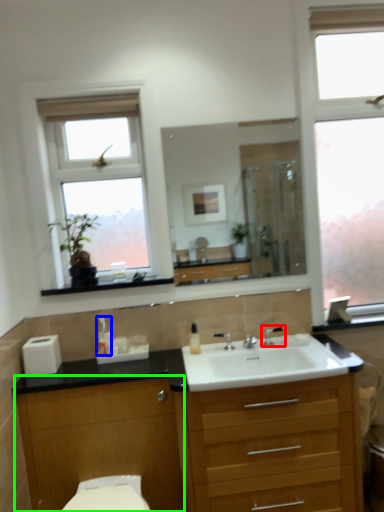
Question: Which is farther away from tap (highlighted by a red box)? soap dispenser (highlighted by a blue box) or cabinetry (highlighted by a green box)?

Choices:
 (A) soap dispenser
 (B) cabinetry

Answer: (B)